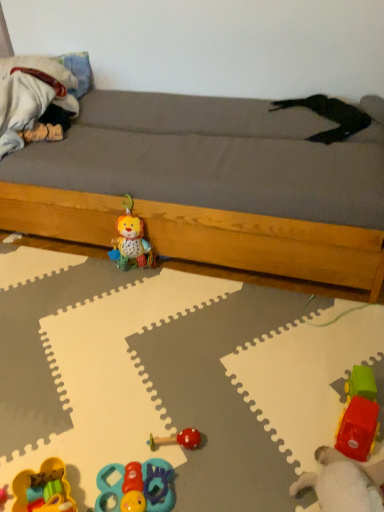
This screenshot has width=384, height=512. Describe the element at coordinates (210, 185) in the screenshot. I see `wooden bed frame at center` at that location.

What do you see at coordinates (131, 241) in the screenshot? I see `plush fabric lion at center, the 2th toy when ordered from left to right` at bounding box center [131, 241].

This screenshot has height=512, width=384. Find the location of `smooth plastic rattle at center, acting as the fourth toy starting from the left`. smooth plastic rattle at center, acting as the fourth toy starting from the left is located at coordinates (177, 439).

Locate an element on the screen. The height and width of the screenshot is (512, 384). fluffy white blanket at left is located at coordinates (31, 95).

This screenshot has height=512, width=384. Find the location of `rubberized yellow toy at lower left, which is counted as the 6th toy, starting from the right`. rubberized yellow toy at lower left, which is counted as the 6th toy, starting from the right is located at coordinates (43, 489).

What is the approximate width of rubberized yellow toy at lower left, which is counted as the 6th toy, starting from the right?

rubberized yellow toy at lower left, which is counted as the 6th toy, starting from the right, is 9.34 inches wide.

What do you see at coordinates (358, 415) in the screenshot? The image size is (384, 512). I see `rubberized plastic truck at lower right, the 6th toy positioned from the left` at bounding box center [358, 415].

Measure the distance between rubberized plastic car at lower right, the fifth toy when ordered from left to right, and camera.

90.84 centimeters.

You are a GUI agent. You are given a task and a screenshot of the screen. Output one action in this format:
    pyautogui.click(x=<x>, y=<y>)
    Task: Click on the wooden bed frame at center
    
    Given the screenshot: What is the action you would take?
    pyautogui.click(x=210, y=185)

From the image's perspective, which one is positioned lower, rubberized plastic car at lower right, the fifth toy when ordered from left to right, or wooden bed frame at center?

rubberized plastic car at lower right, the fifth toy when ordered from left to right, is shown below in the image.

From a real-world perspective, is rubberized plastic car at lower right, the fifth toy when ordered from left to right, on wooden bed frame at center?

Actually, rubberized plastic car at lower right, the fifth toy when ordered from left to right, is physically below wooden bed frame at center in the real world.

From the picture: Considering the sizes of rubberized plastic car at lower right, the second toy from the right, and wooden bed frame at center in the image, is rubberized plastic car at lower right, the second toy from the right, bigger or smaller than wooden bed frame at center?

rubberized plastic car at lower right, the second toy from the right, is smaller than wooden bed frame at center.

From a real-world perspective, does fluffy white blanket at left stand above rubberized blue and red toy at lower center, which appears as the third toy when viewed from the left?

Yes, from a real-world perspective, fluffy white blanket at left is above rubberized blue and red toy at lower center, which appears as the third toy when viewed from the left.

Is fluffy white blanket at left oriented away from rubberized blue and red toy at lower center, arranged as the 4th toy when viewed from the right?

fluffy white blanket at left is not turned away from rubberized blue and red toy at lower center, arranged as the 4th toy when viewed from the right.

Is fluffy white blanket at left placed right next to rubberized blue and red toy at lower center, which appears as the third toy when viewed from the left?

There is a gap between fluffy white blanket at left and rubberized blue and red toy at lower center, which appears as the third toy when viewed from the left.

Does point (2, 145) lie behind point (109, 470)?

That is True.

Does point (149, 506) come closer to viewer compared to point (322, 503)?

That is False.

Based on their positions, is rubberized blue and red toy at lower center, which appears as the third toy when viewed from the left, located to the left or right of rubberized plastic car at lower right, the fifth toy when ordered from left to right?

Clearly, rubberized blue and red toy at lower center, which appears as the third toy when viewed from the left, is on the left of rubberized plastic car at lower right, the fifth toy when ordered from left to right, in the image.

Between rubberized blue and red toy at lower center, which appears as the third toy when viewed from the left, and rubberized plastic car at lower right, the second toy from the right, which one is positioned in front?

Positioned in front is rubberized plastic car at lower right, the second toy from the right.

Is rubberized blue and red toy at lower center, arranged as the 4th toy when viewed from the right, bigger or smaller than rubberized plastic car at lower right, the fifth toy when ordered from left to right?

rubberized blue and red toy at lower center, arranged as the 4th toy when viewed from the right, is smaller than rubberized plastic car at lower right, the fifth toy when ordered from left to right.

From a real-world perspective, between fluffy white blanket at left and rubberized plastic truck at lower right, marked as the 1th toy in a right-to-left arrangement, who is vertically lower?

From a 3D spatial view, rubberized plastic truck at lower right, marked as the 1th toy in a right-to-left arrangement, is below.

Is fluffy white blanket at left closer to camera compared to rubberized plastic truck at lower right, marked as the 1th toy in a right-to-left arrangement?

No, it is behind rubberized plastic truck at lower right, marked as the 1th toy in a right-to-left arrangement.

Is fluffy white blanket at left positioned with its back to rubberized plastic truck at lower right, marked as the 1th toy in a right-to-left arrangement?

No.

In terms of size, does fluffy white blanket at left appear bigger or smaller than rubberized plastic truck at lower right, the 6th toy positioned from the left?

Clearly, fluffy white blanket at left is larger in size than rubberized plastic truck at lower right, the 6th toy positioned from the left.

From the image's perspective, between rubberized plastic truck at lower right, marked as the 1th toy in a right-to-left arrangement, and rubberized yellow toy at lower left, which is counted as the 6th toy, starting from the right, which one is located above?

rubberized plastic truck at lower right, marked as the 1th toy in a right-to-left arrangement, appears higher in the image.

Is rubberized plastic truck at lower right, the 6th toy positioned from the left, inside or outside of rubberized yellow toy at lower left, marked as the first toy in a left-to-right arrangement?

rubberized plastic truck at lower right, the 6th toy positioned from the left, cannot be found inside rubberized yellow toy at lower left, marked as the first toy in a left-to-right arrangement.

From a real-world perspective, is rubberized plastic truck at lower right, the 6th toy positioned from the left, on rubberized yellow toy at lower left, which is counted as the 6th toy, starting from the right?

Yes, from a real-world perspective, rubberized plastic truck at lower right, the 6th toy positioned from the left, is above rubberized yellow toy at lower left, which is counted as the 6th toy, starting from the right.

Does rubberized plastic truck at lower right, marked as the 1th toy in a right-to-left arrangement, touch rubberized yellow toy at lower left, marked as the first toy in a left-to-right arrangement?

No, rubberized plastic truck at lower right, marked as the 1th toy in a right-to-left arrangement, is not in contact with rubberized yellow toy at lower left, marked as the first toy in a left-to-right arrangement.

How different are the orientations of rubberized blue and red toy at lower center, arranged as the 4th toy when viewed from the right, and smooth plastic rattle at center, acting as the fourth toy starting from the left, in degrees?

88.6 degrees.

How distant is rubberized blue and red toy at lower center, arranged as the 4th toy when viewed from the right, from smooth plastic rattle at center, acting as the fourth toy starting from the left?

4.29 inches.

Based on their sizes in the image, would you say rubberized blue and red toy at lower center, arranged as the 4th toy when viewed from the right, is bigger or smaller than smooth plastic rattle at center, acting as the fourth toy starting from the left?

Clearly, rubberized blue and red toy at lower center, arranged as the 4th toy when viewed from the right, is larger in size than smooth plastic rattle at center, acting as the fourth toy starting from the left.

Between rubberized blue and red toy at lower center, arranged as the 4th toy when viewed from the right, and smooth plastic rattle at center, acting as the fourth toy starting from the left, which one has larger width?

Wider between the two is rubberized blue and red toy at lower center, arranged as the 4th toy when viewed from the right.

In the scene shown: From the image's perspective, would you say fluffy white blanket at left is positioned over plush fabric lion at center, the 2th toy when ordered from left to right?

Indeed, from the image's perspective, fluffy white blanket at left is shown above plush fabric lion at center, the 2th toy when ordered from left to right.

Is there a large distance between fluffy white blanket at left and plush fabric lion at center, the 2th toy when ordered from left to right?

That's not correct — fluffy white blanket at left is a little close to plush fabric lion at center, the 2th toy when ordered from left to right.

Consider the image. From a real-world perspective, is fluffy white blanket at left positioned over plush fabric lion at center, arranged as the 5th toy when viewed from the right, based on gravity?

Yes, from a real-world perspective, fluffy white blanket at left is on top of plush fabric lion at center, arranged as the 5th toy when viewed from the right.

Measure the distance between fluffy white blanket at left and plush fabric lion at center, arranged as the 5th toy when viewed from the right.

The distance of fluffy white blanket at left from plush fabric lion at center, arranged as the 5th toy when viewed from the right, is 27.47 inches.

Where is `bed frame that is above the rubberized plastic car at lower right, the second toy from the right (from the image's perspective)`? The image size is (384, 512). bed frame that is above the rubberized plastic car at lower right, the second toy from the right (from the image's perspective) is located at coordinates (210, 185).

This screenshot has width=384, height=512. In order to click on animal on the left of rubberized blue and red toy at lower center, arranged as the 4th toy when viewed from the right in this screenshot , I will do `click(31, 95)`.

Looking at the image, which one is located further to rubberized blue and red toy at lower center, arranged as the 4th toy when viewed from the right, rubberized yellow toy at lower left, which is counted as the 6th toy, starting from the right, or rubberized plastic car at lower right, the fifth toy when ordered from left to right?

rubberized plastic car at lower right, the fifth toy when ordered from left to right.

When comparing their distances from rubberized plastic truck at lower right, marked as the 1th toy in a right-to-left arrangement, does plush fabric lion at center, arranged as the 5th toy when viewed from the right, or fluffy white blanket at left seem further?

Answer: fluffy white blanket at left.

Considering their positions, is wooden bed frame at center positioned further to rubberized plastic car at lower right, the fifth toy when ordered from left to right, than rubberized blue and red toy at lower center, which appears as the third toy when viewed from the left?

wooden bed frame at center is further to rubberized plastic car at lower right, the fifth toy when ordered from left to right.

From the image, which object appears to be nearer to rubberized plastic truck at lower right, marked as the 1th toy in a right-to-left arrangement, plush fabric lion at center, the 2th toy when ordered from left to right, or smooth plastic rattle at center, the 3th toy viewed from the right?

smooth plastic rattle at center, the 3th toy viewed from the right.

From the image, which object appears to be farther from rubberized yellow toy at lower left, marked as the first toy in a left-to-right arrangement, plush fabric lion at center, the 2th toy when ordered from left to right, or rubberized plastic truck at lower right, the 6th toy positioned from the left?

plush fabric lion at center, the 2th toy when ordered from left to right, is further to rubberized yellow toy at lower left, marked as the first toy in a left-to-right arrangement.

When comparing their distances from smooth plastic rattle at center, acting as the fourth toy starting from the left, does plush fabric lion at center, arranged as the 5th toy when viewed from the right, or rubberized plastic truck at lower right, the 6th toy positioned from the left, seem further?

plush fabric lion at center, arranged as the 5th toy when viewed from the right, lies further to smooth plastic rattle at center, acting as the fourth toy starting from the left, than the other object.

When comparing their distances from rubberized yellow toy at lower left, which is counted as the 6th toy, starting from the right, does rubberized blue and red toy at lower center, arranged as the 4th toy when viewed from the right, or fluffy white blanket at left seem further?

fluffy white blanket at left.

From the image, which object appears to be farther from wooden bed frame at center, rubberized yellow toy at lower left, which is counted as the 6th toy, starting from the right, or rubberized blue and red toy at lower center, which appears as the third toy when viewed from the left?

rubberized yellow toy at lower left, which is counted as the 6th toy, starting from the right.

I want to click on toy located between rubberized blue and red toy at lower center, which appears as the third toy when viewed from the left, and rubberized plastic car at lower right, the second toy from the right, in the left-right direction, so click(x=177, y=439).

Identify the location of bed frame between fluffy white blanket at left and rubberized plastic car at lower right, the fifth toy when ordered from left to right, vertically. The image size is (384, 512). (210, 185).

Where is `toy that lies between wooden bed frame at center and rubberized plastic truck at lower right, marked as the 1th toy in a right-to-left arrangement, from top to bottom`? The width and height of the screenshot is (384, 512). toy that lies between wooden bed frame at center and rubberized plastic truck at lower right, marked as the 1th toy in a right-to-left arrangement, from top to bottom is located at coordinates (131, 241).

Where is `toy located between smooth plastic rattle at center, the 3th toy viewed from the right, and rubberized plastic truck at lower right, the 6th toy positioned from the left, in the left-right direction`? The width and height of the screenshot is (384, 512). toy located between smooth plastic rattle at center, the 3th toy viewed from the right, and rubberized plastic truck at lower right, the 6th toy positioned from the left, in the left-right direction is located at coordinates (344, 483).